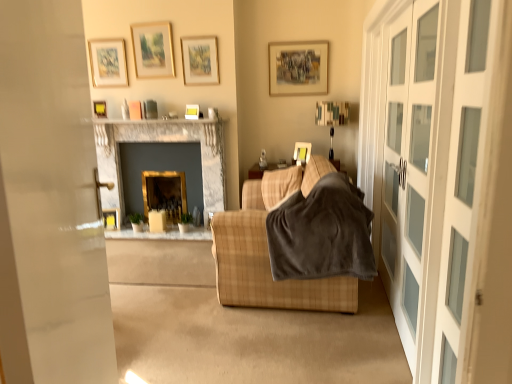
Question: Is matte gold picture frame at upper left, which ranks as the 6th picture frame in right-to-left order, turned away from wooden picture frame at lower left, which appears as the second picture frame when viewed from the left?

Choices:
 (A) no
 (B) yes

Answer: (A)

Question: Is wooden picture frame at lower left, which appears as the second picture frame when viewed from the left, completely or partially inside matte gold picture frame at upper left, which ranks as the 6th picture frame in right-to-left order?

Choices:
 (A) yes
 (B) no

Answer: (B)

Question: Is matte gold picture frame at upper left, the third picture frame from the left, taller than wooden picture frame at lower left, the seventh picture frame from the right?

Choices:
 (A) yes
 (B) no

Answer: (A)

Question: From a real-world perspective, is matte gold picture frame at upper left, which ranks as the 6th picture frame in right-to-left order, beneath wooden picture frame at lower left, the seventh picture frame from the right?

Choices:
 (A) yes
 (B) no

Answer: (B)

Question: From a real-world perspective, is matte gold picture frame at upper left, which ranks as the 6th picture frame in right-to-left order, on top of wooden picture frame at lower left, which appears as the second picture frame when viewed from the left?

Choices:
 (A) no
 (B) yes

Answer: (B)

Question: Is matte gold picture frame at upper left, the third picture frame from the left, positioned in front of wooden picture frame at lower left, which appears as the second picture frame when viewed from the left?

Choices:
 (A) no
 (B) yes

Answer: (B)

Question: Does matte gold picture frame at upper center, the 5th picture frame in the right-to-left sequence, touch matte brown picture frame at upper center, the second picture frame in the right-to-left sequence?

Choices:
 (A) yes
 (B) no

Answer: (B)

Question: Could you tell me if matte gold picture frame at upper center, which is the 4th picture frame in left-to-right order, is turned towards matte brown picture frame at upper center, the second picture frame in the right-to-left sequence?

Choices:
 (A) no
 (B) yes

Answer: (A)

Question: From the image's perspective, is matte gold picture frame at upper center, the 5th picture frame in the right-to-left sequence, below matte brown picture frame at upper center, the second picture frame in the right-to-left sequence?

Choices:
 (A) no
 (B) yes

Answer: (A)

Question: Is the position of matte gold picture frame at upper center, the 5th picture frame in the right-to-left sequence, more distant than that of matte brown picture frame at upper center, the second picture frame in the right-to-left sequence?

Choices:
 (A) no
 (B) yes

Answer: (A)

Question: Can you confirm if matte gold picture frame at upper center, which is the 4th picture frame in left-to-right order, is wider than matte brown picture frame at upper center, the second picture frame in the right-to-left sequence?

Choices:
 (A) yes
 (B) no

Answer: (B)

Question: Does matte gold picture frame at upper center, which is the 4th picture frame in left-to-right order, have a smaller size compared to matte brown picture frame at upper center, which appears as the seventh picture frame when viewed from the left?

Choices:
 (A) no
 (B) yes

Answer: (B)

Question: Is velvety brown blanket at center shorter than matte gold picture frame at upper left, which ranks as the 6th picture frame in right-to-left order?

Choices:
 (A) yes
 (B) no

Answer: (B)